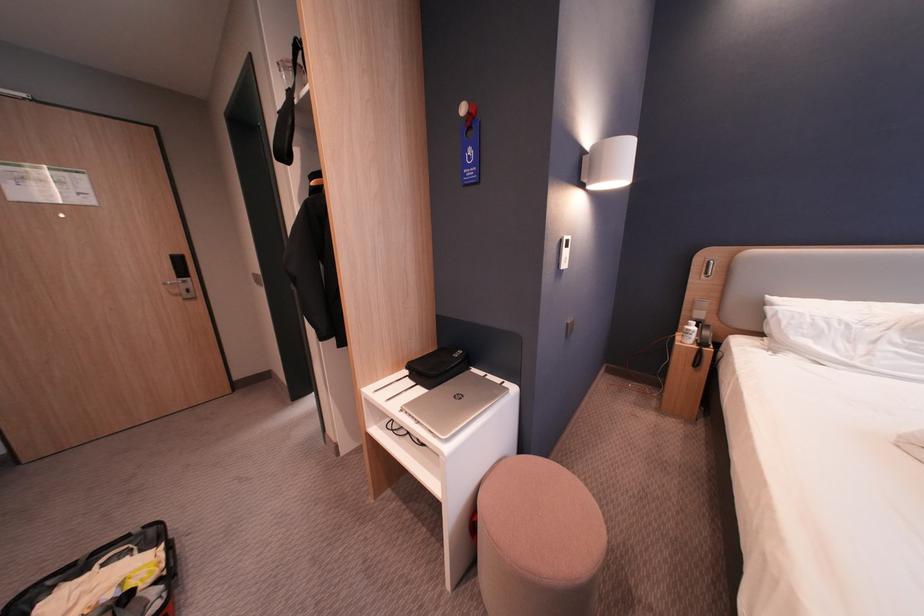
Find where to lift the blue door sign. Please return your answer as a coordinate pair (x, y).

(469, 153)